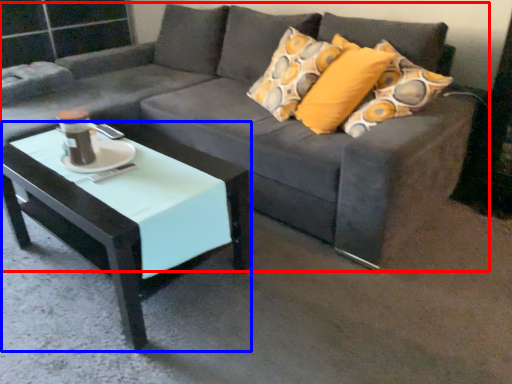
Question: Which of the following is the closest to the observer, studio couch (highlighted by a red box) or coffee table (highlighted by a blue box)?

Choices:
 (A) studio couch
 (B) coffee table

Answer: (A)